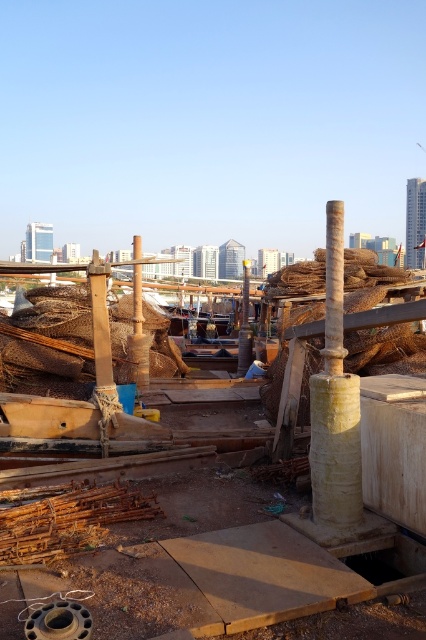
Which is above, brown woven netting at center or rusty wire mesh at center?

rusty wire mesh at center

Can you confirm if brown woven netting at center is positioned to the left of rusty wire mesh at center?

No, brown woven netting at center is not to the left of rusty wire mesh at center.

Find the location of a particular element. The width and height of the screenshot is (426, 640). brown woven netting at center is located at coordinates (296, 540).

This screenshot has width=426, height=640. I want to click on brown woven netting at center, so click(x=296, y=540).

Locate an element on the screen. The image size is (426, 640). brown woven netting at center is located at coordinates (296, 540).

This screenshot has height=640, width=426. I want to click on brown woven netting at center, so click(x=296, y=540).

Find the location of a particular element. brown woven netting at center is located at coordinates (296, 540).

Does yellowish concrete pole at center-right lie in front of rusty metal rods at lower left?

That is False.

Who is more forward, (328, 371) or (28, 538)?

Point (28, 538) is more forward.

Where is `yellowish concrete pole at center-right`? yellowish concrete pole at center-right is located at coordinates (334, 403).